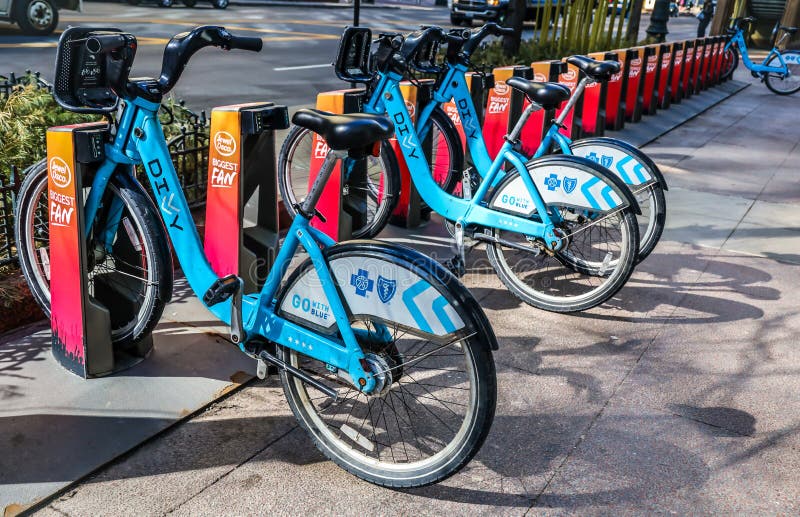
Locate an element on the screen. The height and width of the screenshot is (517, 800). fork is located at coordinates (93, 212), (118, 216), (350, 168), (429, 135), (418, 124), (726, 45).